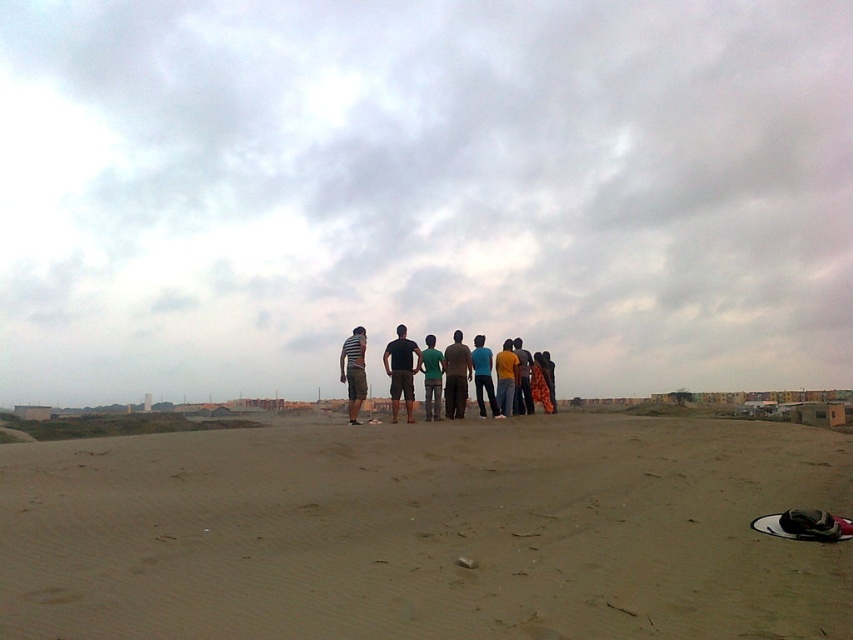
Question: Which point is closer to the camera taking this photo?

Choices:
 (A) (476, 358)
 (B) (511, 387)
 (C) (527, 396)

Answer: (B)

Question: Can you confirm if dark blue t-shirt at center is thinner than yellow cotton shirt at center?

Choices:
 (A) yes
 (B) no

Answer: (A)

Question: Where is smooth sand at center located in relation to yellow matte shirt at center in the image?

Choices:
 (A) above
 (B) below

Answer: (B)

Question: From the image, what is the correct spatial relationship of dark gray fabric pants at center in relation to matte blue shirt at center?

Choices:
 (A) right
 (B) left

Answer: (B)

Question: Estimate the real-world distances between objects in this image. Which object is farther from the dark gray fabric pants at center?

Choices:
 (A) green matte shirt at center
 (B) dark blue t-shirt at center
 (C) striped fabric shirt at center

Answer: (C)

Question: Which object is positioned farthest from the dark blue t-shirt at center?

Choices:
 (A) dark gray fabric pants at center
 (B) yellow matte shirt at center
 (C) green matte shirt at center
 (D) matte blue shirt at center

Answer: (B)